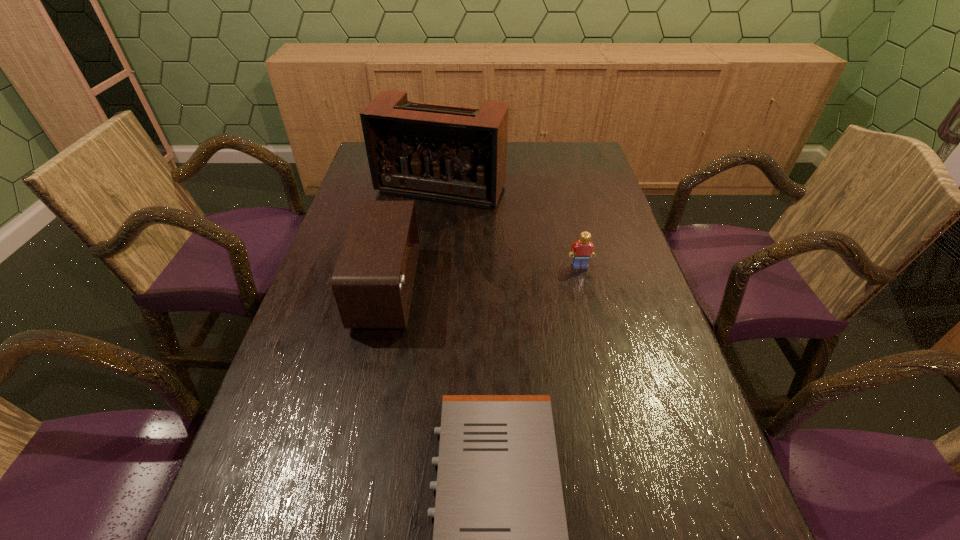
Locate an element on the screen. object that is the second closest to the nearest object is located at coordinates (581, 251).

Identify which object is the third nearest to the rightmost object. Please provide its 2D coordinates. Your answer should be formatted as a tuple, i.e. [(x, y)], where the tuple contains the x and y coordinates of a point satisfying the conditions above.

[(500, 539)]

The width and height of the screenshot is (960, 540). Find the location of `the closest radio receiver to the Lego`. the closest radio receiver to the Lego is located at coordinates (452, 154).

Where is `radio receiver that is the closest to the second nearest radio receiver`? The width and height of the screenshot is (960, 540). radio receiver that is the closest to the second nearest radio receiver is located at coordinates (452, 154).

Where is `vacant area that satisfies the following two spatial constraints: 1. on the front-facing side of the Lego; 2. on the front-facing side of the second tallest radio receiver`? Image resolution: width=960 pixels, height=540 pixels. vacant area that satisfies the following two spatial constraints: 1. on the front-facing side of the Lego; 2. on the front-facing side of the second tallest radio receiver is located at coordinates (586, 288).

Identify the location of vacant area in the image that satisfies the following two spatial constraints: 1. on the front side of the farthest object; 2. on the front-facing side of the second nearest radio receiver. This screenshot has height=540, width=960. (429, 288).

At what (x,y) coordinates should I click in order to perform the action: click on vacant region that satisfies the following two spatial constraints: 1. on the front-facing side of the rightmost object; 2. on the front-facing side of the second tallest radio receiver. Please return your answer as a coordinate pair (x, y). Image resolution: width=960 pixels, height=540 pixels. Looking at the image, I should click on (586, 288).